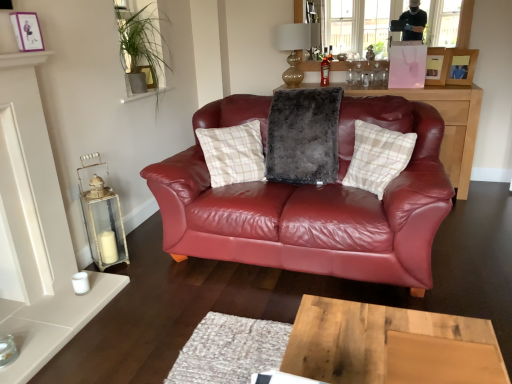
You are a GUI agent. You are given a task and a screenshot of the screen. Output one action in this format:
    pyautogui.click(x=<x>, y=<y>)
    Task: Click on the vacant area that is in front of matte pink picture frame at upper right, the first picture frame from the back
    This screenshot has width=512, height=384.
    Given the screenshot: What is the action you would take?
    pyautogui.click(x=446, y=91)